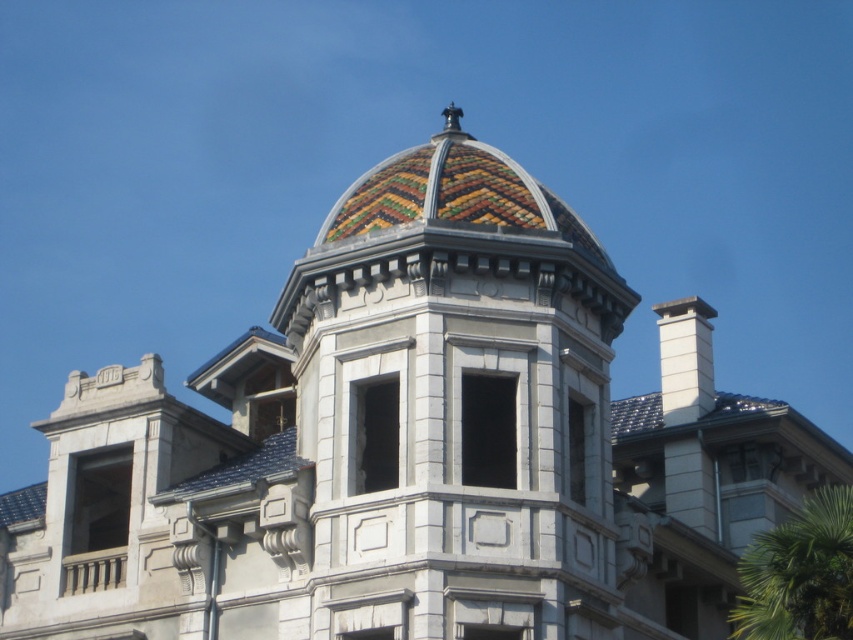
In the scene shown: You are standing in front of the grand building and want to take a photo of the multicolored mosaic dome at center and the green leafy palm tree at lower right. Which object should you point your camera upwards to capture?

You should point your camera upwards to capture the multicolored mosaic dome at center because it is located above the green leafy palm tree at lower right.

What are the coordinates of the multicolored mosaic dome at center?

The coordinates of the multicolored mosaic dome at center are at point (x=456, y=403).